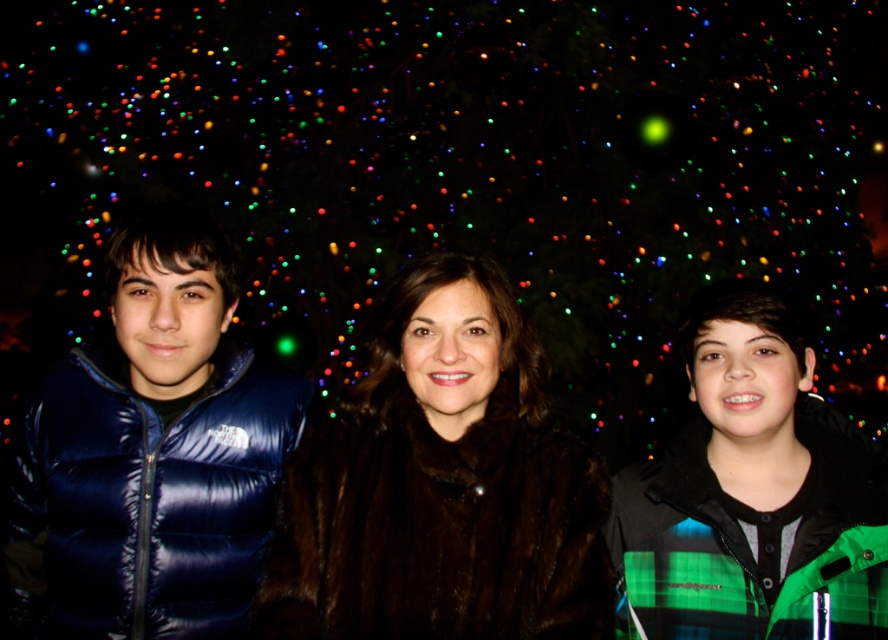
You are a tailor measuring the space between two coats for a display. The coats are the brown fur coat at center and the shiny blue vest at left. The display shelf is 50 centimeters wide. Will the two coats fit side by side on the shelf?

The distance between the brown fur coat at center and the shiny blue vest at left is 45.02 centimeters. Since the shelf is 50 centimeters wide, there is enough space to fit both coats side by side with approximately 4.98 centimeters of extra space remaining.

You are a photographer trying to capture a group photo of the brown fur coat at center and the green plaid jacket at center. If you want to ensure both coats are fully visible in the frame, which coat should you position closer to the camera to avoid cropping?

The brown fur coat at center is wider than the green plaid jacket at center. To ensure both are fully visible, position the brown fur coat at center closer to the camera so its width can be accommodated in the frame without cropping.

You are standing in front of the Christmas tree and want to determine which of the two points, point (153, 384) or point (809, 464), is closer to you. Based on the scene description, which point is nearer?

Point (153, 384) is further to the viewer than point (809, 464). Wait, no, the description says the opposite. Let me check again. The Objects Description states that point (153, 384) is further to the viewer than point (809, 464). Hmm, so that means point 0.600 is farther away, so the closer one would be point 0.725? Wait, no. If point A is further than point B, then point B is closer. So the answer should be point 0.600 is further, so the closer point is 0.725. But the question asks which is nearer